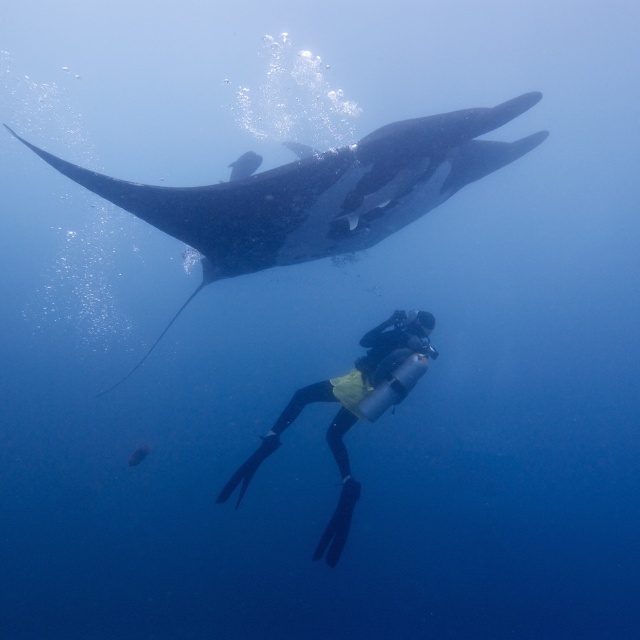
Question: Does dark gray matte stingray at upper center appear on the left side of yellow neoprene suit at center?

Choices:
 (A) yes
 (B) no

Answer: (A)

Question: Where is dark gray matte stingray at upper center located in relation to yellow neoprene suit at center in the image?

Choices:
 (A) right
 (B) left

Answer: (B)

Question: Which object is farther from the camera taking this photo?

Choices:
 (A) dark gray matte stingray at upper center
 (B) yellow neoprene suit at center

Answer: (B)

Question: In this image, where is dark gray matte stingray at upper center located relative to yellow neoprene suit at center?

Choices:
 (A) below
 (B) above

Answer: (B)